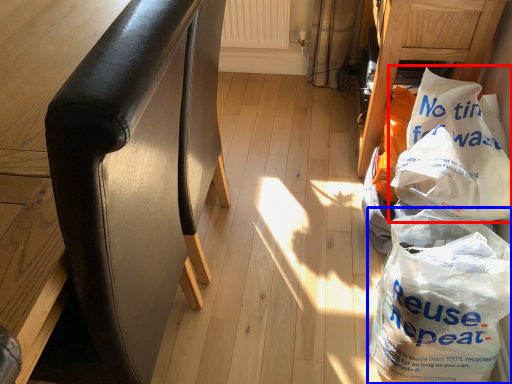
Question: Which of the following is the farthest to the observer, plastic bag (highlighted by a red box) or plastic bag (highlighted by a blue box)?

Choices:
 (A) plastic bag
 (B) plastic bag

Answer: (A)